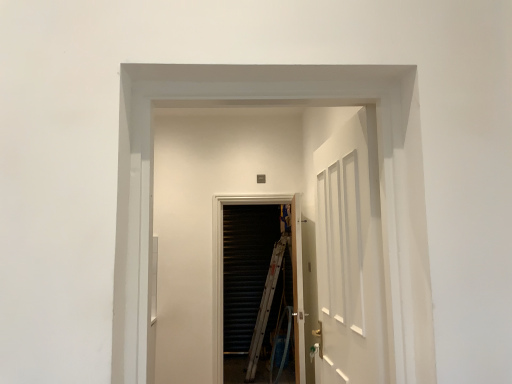
What is the approximate width of black metal screen door at center?

The width of black metal screen door at center is 7.58 inches.

The width and height of the screenshot is (512, 384). What do you see at coordinates (268, 194) in the screenshot?
I see `white glossy elevator at center` at bounding box center [268, 194].

The width and height of the screenshot is (512, 384). What are the coordinates of `white wooden door at center` in the screenshot? It's located at (350, 254).

Find the location of `black metal screen door at center`. black metal screen door at center is located at coordinates (222, 261).

Would you say white wooden door at center is a long distance from black metal screen door at center?

That's right, there is a large distance between white wooden door at center and black metal screen door at center.

From the image's perspective, is white wooden door at center under black metal screen door at center?

Actually, white wooden door at center appears above black metal screen door at center in the image.

Which is more to the left, white wooden door at center or black metal screen door at center?

Positioned to the left is black metal screen door at center.

Is black metal screen door at center closer to the viewer compared to white glossy elevator at center?

No.

Can you confirm if black metal screen door at center is taller than white glossy elevator at center?

Yes, black metal screen door at center is taller than white glossy elevator at center.

Is black metal screen door at center inside the boundaries of white glossy elevator at center, or outside?

black metal screen door at center exists outside the volume of white glossy elevator at center.

Locate an element on the screen. Image resolution: width=512 pixels, height=384 pixels. screen door below the white glossy elevator at center (from the image's perspective) is located at coordinates (222, 261).

From a real-world perspective, is white glossy elevator at center physically located above or below white wooden door at center?

Clearly, from a real-world perspective, white glossy elevator at center is above white wooden door at center.

How different are the orientations of white glossy elevator at center and white wooden door at center in degrees?

The angle between the facing direction of white glossy elevator at center and the facing direction of white wooden door at center is 88.2 degrees.

In terms of size, does white glossy elevator at center appear bigger or smaller than white wooden door at center?

In the image, white glossy elevator at center appears to be smaller than white wooden door at center.

Is black metal screen door at center to the left of white wooden door at center from the viewer's perspective?

Correct, you'll find black metal screen door at center to the left of white wooden door at center.

Is black metal screen door at center aimed at white wooden door at center?

Yes, black metal screen door at center is facing white wooden door at center.

How different are the orientations of black metal screen door at center and white wooden door at center in degrees?

87.7 degrees.

Based on the photo, how many degrees apart are the facing directions of white glossy elevator at center and black metal screen door at center?

There is a 0.434-degree angle between the facing directions of white glossy elevator at center and black metal screen door at center.

Who is taller, white glossy elevator at center or black metal screen door at center?

With more height is black metal screen door at center.

Is white glossy elevator at center far away from black metal screen door at center?

They are positioned close to each other.

How distant is white glossy elevator at center from black metal screen door at center?

white glossy elevator at center and black metal screen door at center are 57.30 centimeters apart from each other.

Is point (374, 207) positioned behind point (344, 333)?

No, (374, 207) is in front of (344, 333).

Does white wooden door at center have a greater height compared to white glossy elevator at center?

Yes, white wooden door at center is taller than white glossy elevator at center.

Is white wooden door at center facing towards white glossy elevator at center?

Yes, white wooden door at center is aimed at white glossy elevator at center.

Locate an element on the screen. door above the black metal screen door at center (from a real-world perspective) is located at coordinates (350, 254).

The image size is (512, 384). I want to click on screen door to the left of white glossy elevator at center, so click(222, 261).

Based on their spatial positions, is white glossy elevator at center or white wooden door at center closer to black metal screen door at center?

white glossy elevator at center lies closer to black metal screen door at center than the other object.

Estimate the real-world distances between objects in this image. Which object is further from black metal screen door at center, white wooden door at center or white glossy elevator at center?

white wooden door at center is further to black metal screen door at center.

Looking at the image, which one is located closer to white wooden door at center, white glossy elevator at center or black metal screen door at center?

Among the two, white glossy elevator at center is located nearer to white wooden door at center.

When comparing their distances from white wooden door at center, does black metal screen door at center or white glossy elevator at center seem closer?

white glossy elevator at center is closer to white wooden door at center.

When comparing their distances from white glossy elevator at center, does black metal screen door at center or white wooden door at center seem further?

white wooden door at center.

When comparing their distances from white glossy elevator at center, does white wooden door at center or black metal screen door at center seem further?

white wooden door at center.

The image size is (512, 384). In order to click on door between white glossy elevator at center and black metal screen door at center in the front-back direction in this screenshot , I will do `click(350, 254)`.